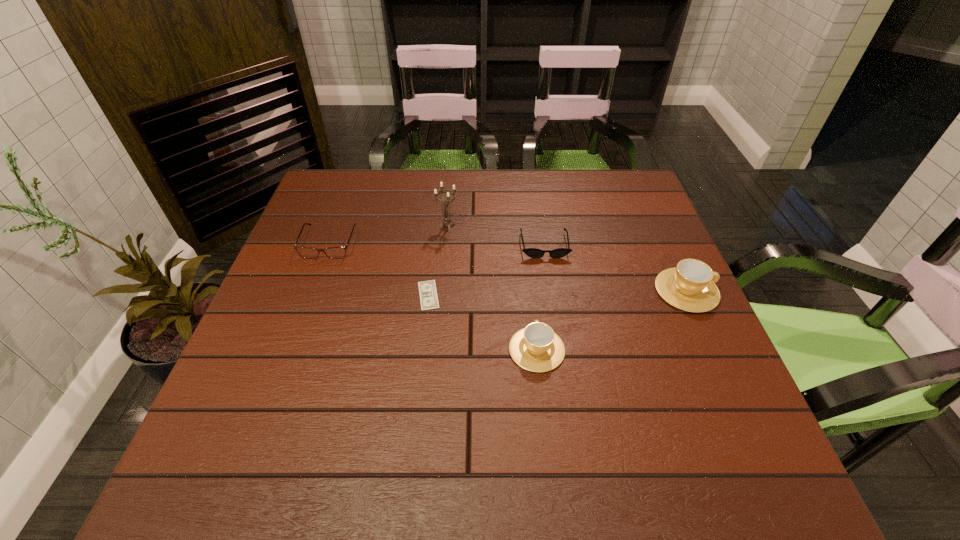
What are the coordinates of `the left cup` in the screenshot? It's located at [536, 348].

Where is `the nearest object`? The height and width of the screenshot is (540, 960). the nearest object is located at coordinates (536, 348).

Where is `the right cup`? The height and width of the screenshot is (540, 960). the right cup is located at coordinates 690,286.

This screenshot has height=540, width=960. I want to click on the taller cup, so click(690, 286).

This screenshot has height=540, width=960. I want to click on the leftmost object, so click(306, 252).

Find the location of `candle holder`. candle holder is located at coordinates (447, 221).

Find the location of a particular element. The width and height of the screenshot is (960, 540). the shortest object is located at coordinates click(x=428, y=295).

This screenshot has width=960, height=540. Identify the location of the fifth tallest object. (531, 252).

You are a GUI agent. You are given a task and a screenshot of the screen. Output one action in this format:
    pyautogui.click(x=<x>, y=<y>)
    Task: Click on the vacant point located 0.290m with the handle on the side of the left cup
    Image resolution: width=960 pixels, height=540 pixels.
    Given the screenshot: What is the action you would take?
    pyautogui.click(x=525, y=243)

Locate an element on the screen. free space located 0.330m with the handle on the side of the left cup is located at coordinates [x=524, y=234].